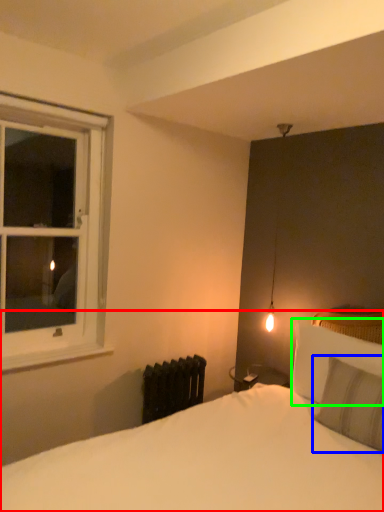
Question: Based on their relative distances, which object is farther from bed (highlighted by a red box)? Choose from pillow (highlighted by a blue box) and pillow (highlighted by a green box).

Choices:
 (A) pillow
 (B) pillow

Answer: (B)